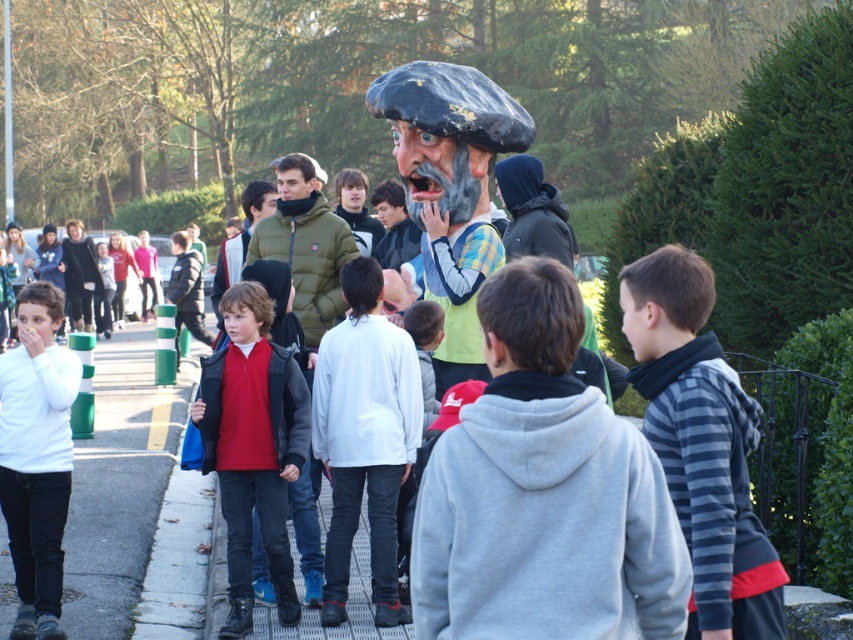
Question: Which of the following is the farthest from the observer?

Choices:
 (A) (68, 371)
 (B) (154, 470)
 (C) (323, 596)

Answer: (B)

Question: Is gray concrete pavement at left below matte black mask at center?

Choices:
 (A) no
 (B) yes

Answer: (B)

Question: From the image, what is the correct spatial relationship of gray fleece jacket at center in relation to gray concrete pavement at left?

Choices:
 (A) above
 (B) below

Answer: (A)

Question: Is gray fleece jacket at center positioned before matte black mask at center?

Choices:
 (A) no
 (B) yes

Answer: (B)

Question: Which point appears farthest from the camera in this image?

Choices:
 (A) (747, 596)
 (B) (370, 337)

Answer: (B)

Question: Estimate the real-world distances between objects in this image. Which object is farther from the gray concrete pavement at left?

Choices:
 (A) white matte sweater at left
 (B) striped sweater at right
 (C) matte red shirt at center
 (D) white matte jacket at center

Answer: (B)